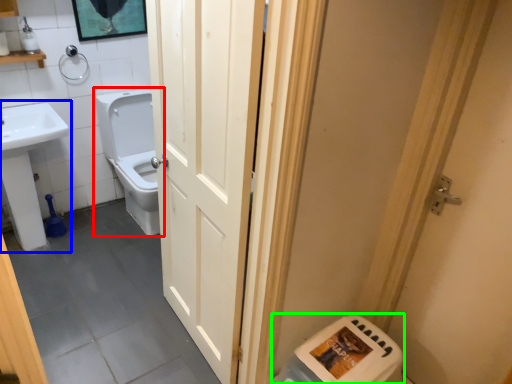
Question: Which is farther away from toilet (highlighted by a red box)? sink (highlighted by a blue box) or water heater (highlighted by a green box)?

Choices:
 (A) sink
 (B) water heater

Answer: (B)